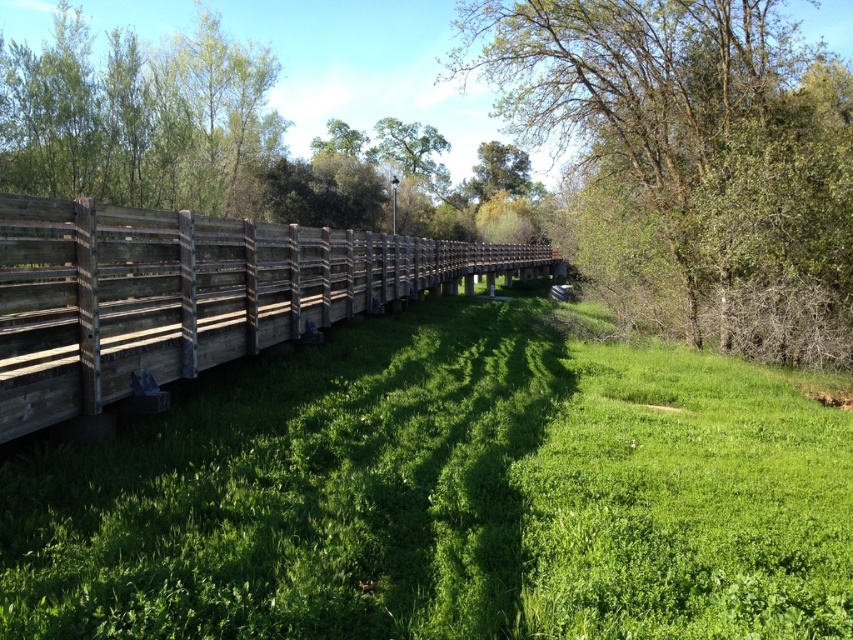
Question: Is green leafy tree at upper right wider than green leafy tree at upper center?

Choices:
 (A) no
 (B) yes

Answer: (B)

Question: Estimate the real-world distances between objects in this image. Which object is farther from the green grassy at left?

Choices:
 (A) green leafy tree at upper right
 (B) green leafy tree at upper center

Answer: (B)

Question: Does green grassy at left appear under weathered wood fence at left?

Choices:
 (A) no
 (B) yes

Answer: (B)

Question: Which point is farther to the camera?

Choices:
 (A) green grassy at left
 (B) weathered wood fence at left
 (C) green leafy tree at upper right

Answer: (C)

Question: Which is nearer to the weathered wood fence at left?

Choices:
 (A) green leafy tree at upper center
 (B) green leafy tree at upper right

Answer: (B)

Question: Is green leafy tree at upper right positioned before weathered wood fence at left?

Choices:
 (A) yes
 (B) no

Answer: (B)